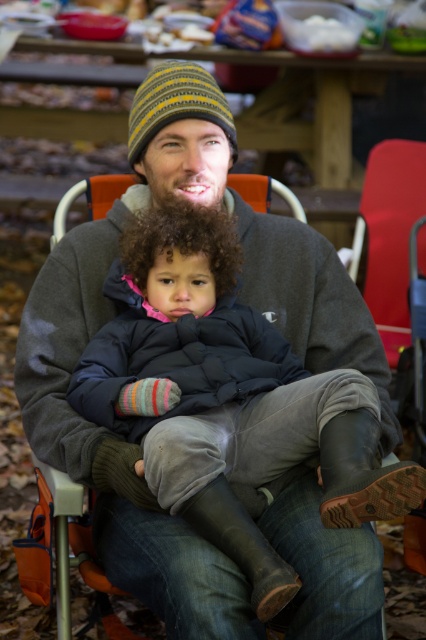
Question: Is red plastic chair at right below yellow striped knit beanie at center?

Choices:
 (A) no
 (B) yes

Answer: (B)

Question: Does red plastic chair at right appear on the right side of yellow striped knit beanie at center?

Choices:
 (A) no
 (B) yes

Answer: (B)

Question: Which point is closer to the camera?

Choices:
 (A) red plastic chair at right
 (B) yellow striped knit beanie at center

Answer: (B)

Question: Which point appears closest to the camera in this image?

Choices:
 (A) (382, 173)
 (B) (155, 90)

Answer: (B)

Question: Where is red plastic chair at right located in relation to yellow striped knit beanie at center in the image?

Choices:
 (A) right
 (B) left

Answer: (A)